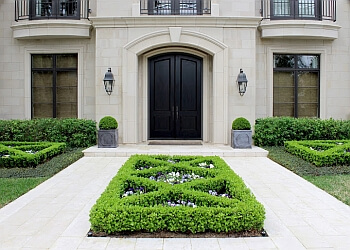
Where is `planter to the left of the door`? The image size is (350, 250). planter to the left of the door is located at coordinates (108, 123).